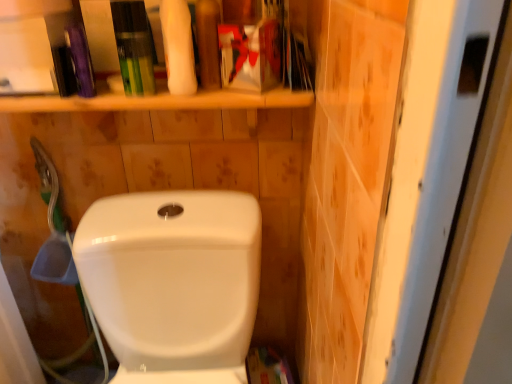
Question: Are white matte sponge at upper center and matte plastic toothpaste tube at upper center, acting as the 2th toiletry starting from the left, beside each other?

Choices:
 (A) no
 (B) yes

Answer: (B)

Question: From a real-world perspective, is white matte sponge at upper center on top of matte plastic toothpaste tube at upper center, acting as the 2th toiletry starting from the left?

Choices:
 (A) no
 (B) yes

Answer: (A)

Question: Can you confirm if white matte sponge at upper center is positioned to the right of matte plastic toothpaste tube at upper center, arranged as the first toiletry when viewed from the right?

Choices:
 (A) yes
 (B) no

Answer: (B)

Question: Is white matte sponge at upper center completely or partially outside of matte plastic toothpaste tube at upper center, acting as the 2th toiletry starting from the left?

Choices:
 (A) no
 (B) yes

Answer: (B)

Question: Can you confirm if white matte sponge at upper center is taller than matte plastic toothpaste tube at upper center, acting as the 2th toiletry starting from the left?

Choices:
 (A) no
 (B) yes

Answer: (A)

Question: Considering the positions of white matte sponge at upper center and white glossy toilet at center in the image, is white matte sponge at upper center taller or shorter than white glossy toilet at center?

Choices:
 (A) tall
 (B) short

Answer: (B)

Question: Choose the correct answer: Is white matte sponge at upper center inside white glossy toilet at center or outside it?

Choices:
 (A) inside
 (B) outside

Answer: (B)

Question: From the image's perspective, is white matte sponge at upper center located above or below white glossy toilet at center?

Choices:
 (A) below
 (B) above

Answer: (B)

Question: Is point (189, 54) positioned closer to the camera than point (114, 220)?

Choices:
 (A) closer
 (B) farther

Answer: (A)

Question: Relative to white glossy toilet at center, is green plastic tube at upper center, placed as the 2th toiletry when sorted from right to left, in front or behind?

Choices:
 (A) front
 (B) behind

Answer: (B)

Question: Do you think green plastic tube at upper center, placed as the 2th toiletry when sorted from right to left, is within white glossy toilet at center, or outside of it?

Choices:
 (A) inside
 (B) outside

Answer: (B)

Question: From the image's perspective, is green plastic tube at upper center, placed as the first toiletry when sorted from left to right, above or below white glossy toilet at center?

Choices:
 (A) below
 (B) above

Answer: (B)

Question: From a real-world perspective, relative to white glossy toilet at center, is green plastic tube at upper center, placed as the 2th toiletry when sorted from right to left, vertically above or below?

Choices:
 (A) above
 (B) below

Answer: (A)

Question: Does point (173, 6) appear closer or farther from the camera than point (145, 82)?

Choices:
 (A) closer
 (B) farther

Answer: (A)

Question: From the image's perspective, relative to green plastic tube at upper center, placed as the first toiletry when sorted from left to right, is white matte sponge at upper center above or below?

Choices:
 (A) below
 (B) above

Answer: (B)